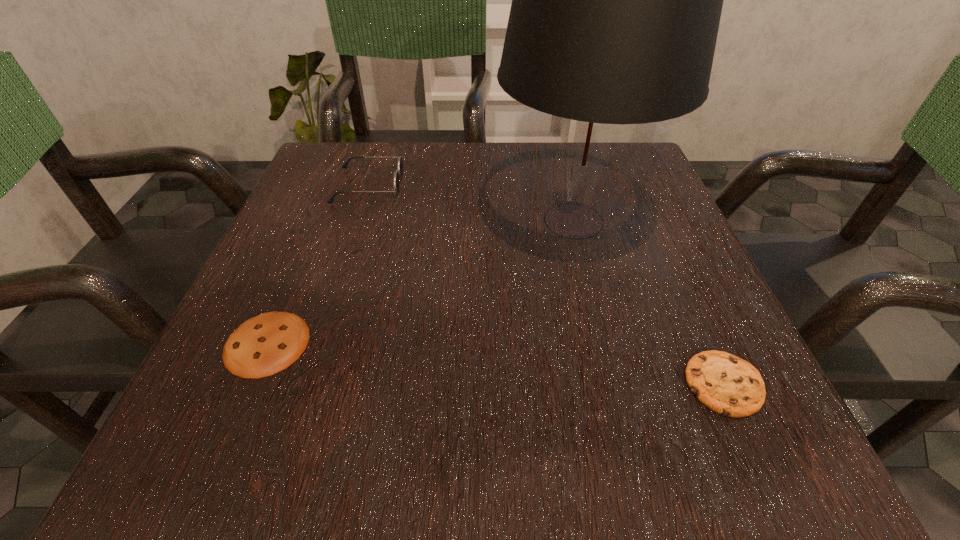
Where is `free space at the right edge of the desktop`? This screenshot has height=540, width=960. free space at the right edge of the desktop is located at coordinates (623, 236).

Identify the location of vacant space at the far left corner of the desktop. The image size is (960, 540). coord(318,190).

Locate an element on the screen. The width and height of the screenshot is (960, 540). free spot between the left cookie and the right cookie is located at coordinates (495, 363).

The image size is (960, 540). I want to click on empty space between the second tallest object and the right cookie, so click(546, 285).

This screenshot has height=540, width=960. Identify the location of free spot between the sunglasses and the left cookie. (318, 264).

Locate an element on the screen. Image resolution: width=960 pixels, height=540 pixels. vacant area that lies between the right cookie and the left cookie is located at coordinates (495, 363).

Where is `free space between the sunglasses and the right cookie`? The image size is (960, 540). free space between the sunglasses and the right cookie is located at coordinates tap(546, 285).

Find the location of a particular element. This screenshot has width=960, height=540. free spot between the tallest object and the right cookie is located at coordinates (649, 302).

Identify the location of free area in between the tallest object and the third shortest object. (471, 203).

Image resolution: width=960 pixels, height=540 pixels. Identify the location of empty space that is in between the left cookie and the right cookie. (495, 363).